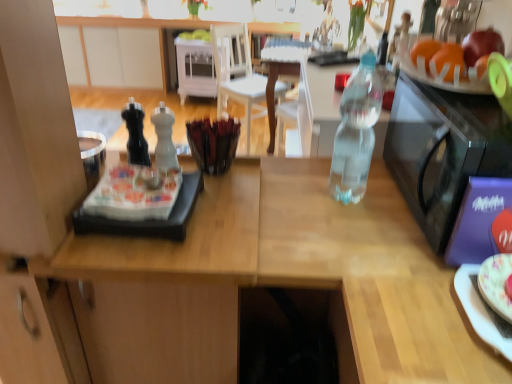
The image size is (512, 384). In order to click on free space in front of clear plastic bottle at center, acting as the 1th bottle starting from the right in this screenshot , I will do `click(353, 231)`.